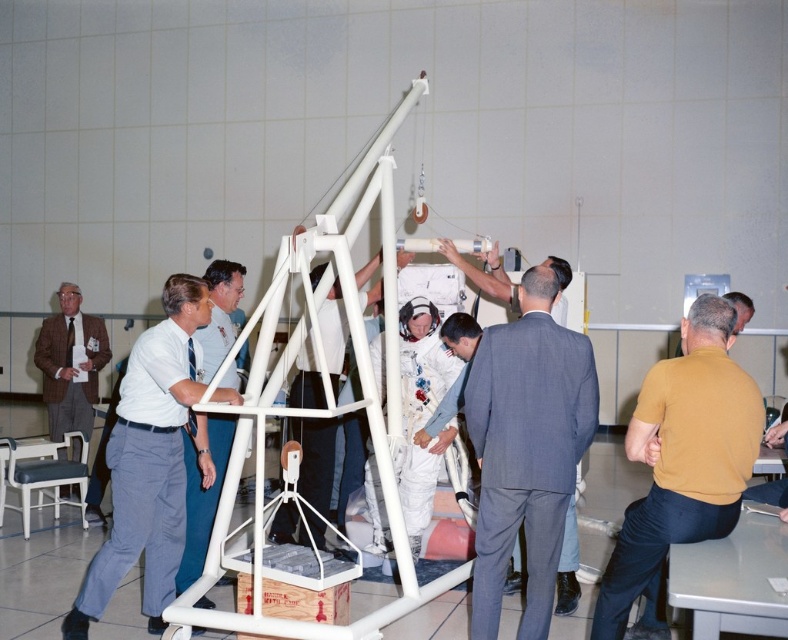
Question: Does gray suit at center have a lesser width compared to matte brown suit at left?

Choices:
 (A) yes
 (B) no

Answer: (A)

Question: Which of these objects is positioned closest to the white shirt at left?

Choices:
 (A) yellow t-shirt at right
 (B) gray suit at center
 (C) matte brown suit at left
 (D) white plastic ladder at center

Answer: (D)

Question: Based on their relative distances, which object is farther from the yellow t-shirt at right?

Choices:
 (A) gray suit at center
 (B) matte brown suit at left
 (C) white plastic ladder at center

Answer: (B)

Question: Is gray suit at center to the left of yellow t-shirt at right from the viewer's perspective?

Choices:
 (A) no
 (B) yes

Answer: (B)

Question: Which point is farther to the camera?

Choices:
 (A) matte brown suit at left
 (B) yellow t-shirt at right

Answer: (A)

Question: From the image, what is the correct spatial relationship of yellow t-shirt at right in relation to white shirt at left?

Choices:
 (A) below
 (B) above

Answer: (A)